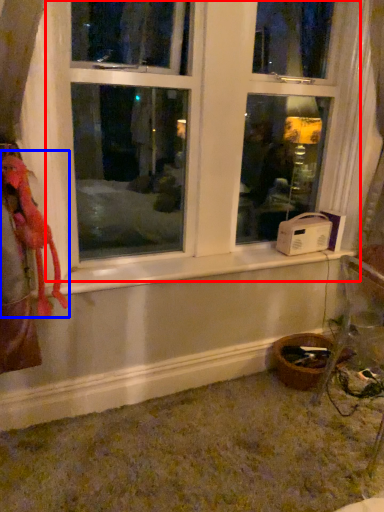
Question: Which point is closer to the camera, window (highlighted by a red box) or animal (highlighted by a blue box)?

Choices:
 (A) window
 (B) animal

Answer: (A)